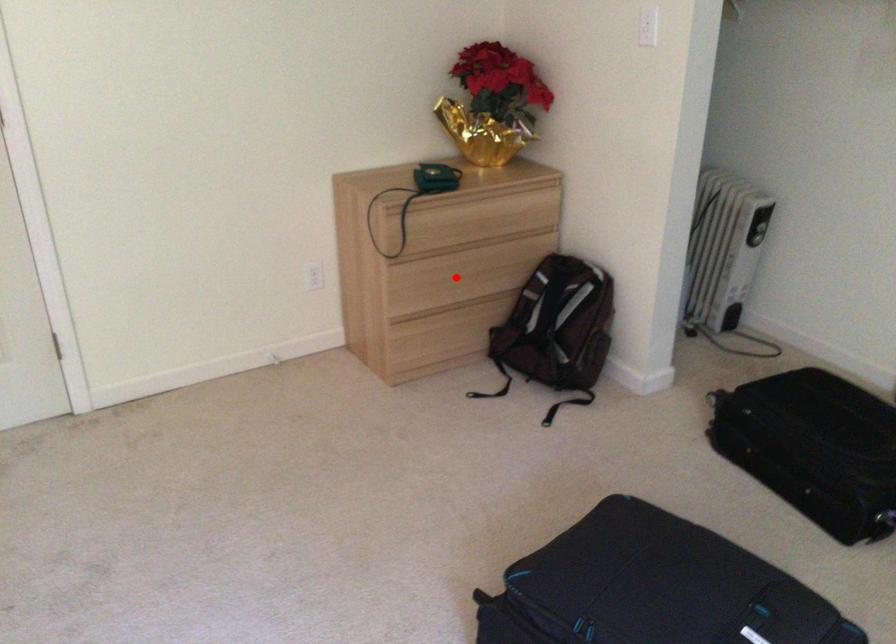
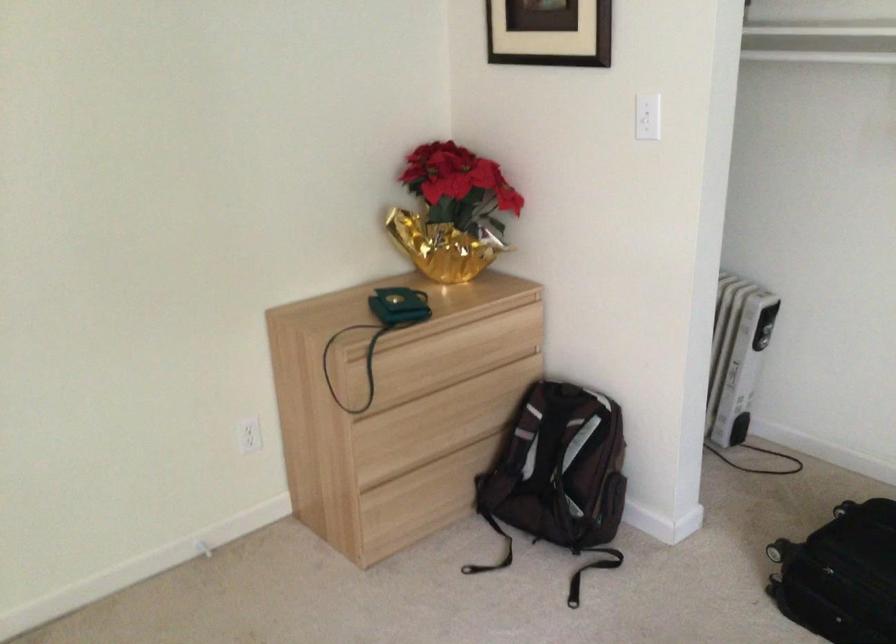
Locate, in the second image, the point that corresponds to the highlighted location in the first image.

(434, 424)